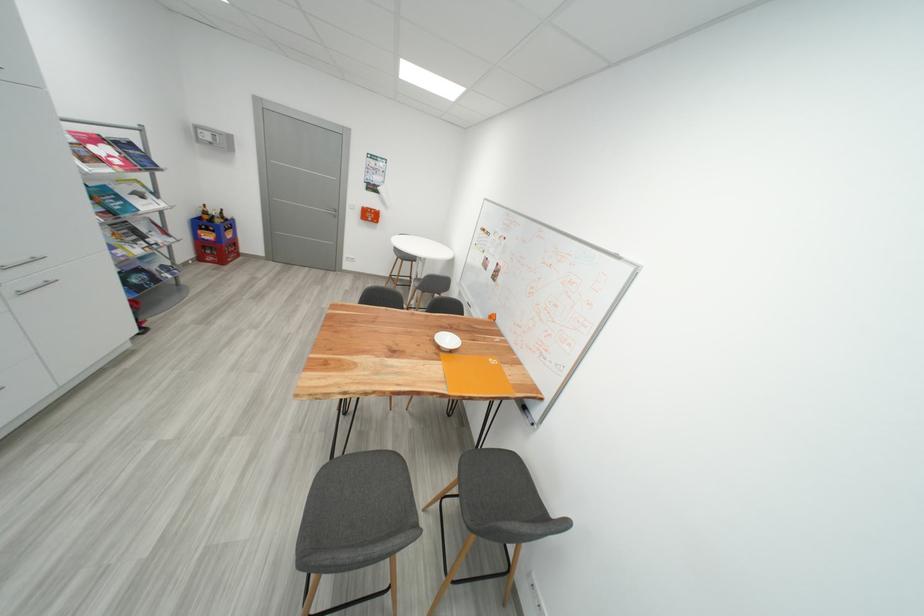
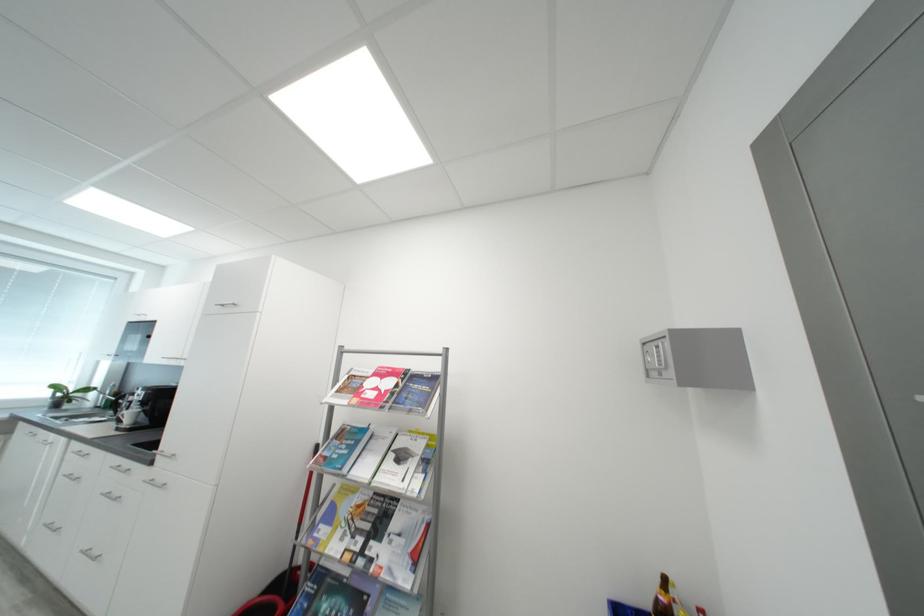
Locate, in the second image, the point that corresponds to (x=214, y=139) in the first image.

(660, 361)